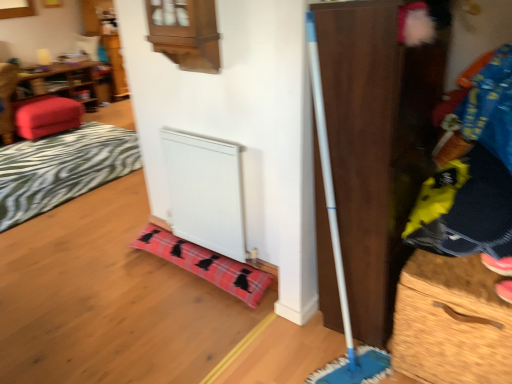
Locate an element on the screen. The image size is (512, 384). free space that is to the left of plaid fabric blanket at lower center, which is the second blanket from left to right is located at coordinates (104, 274).